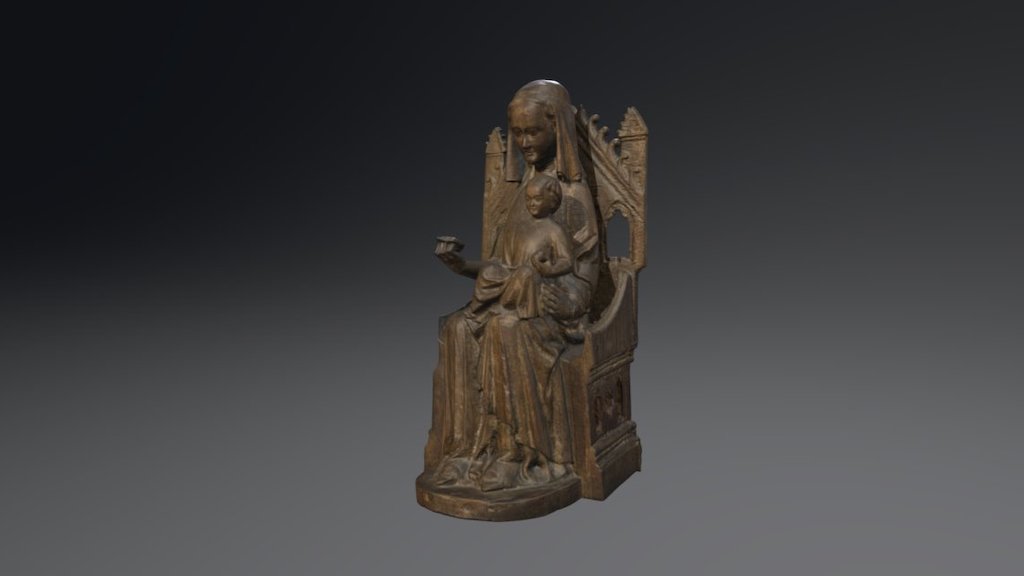
Image resolution: width=1024 pixels, height=576 pixels. What are the coordinates of `throne` in the screenshot? It's located at (613, 181).